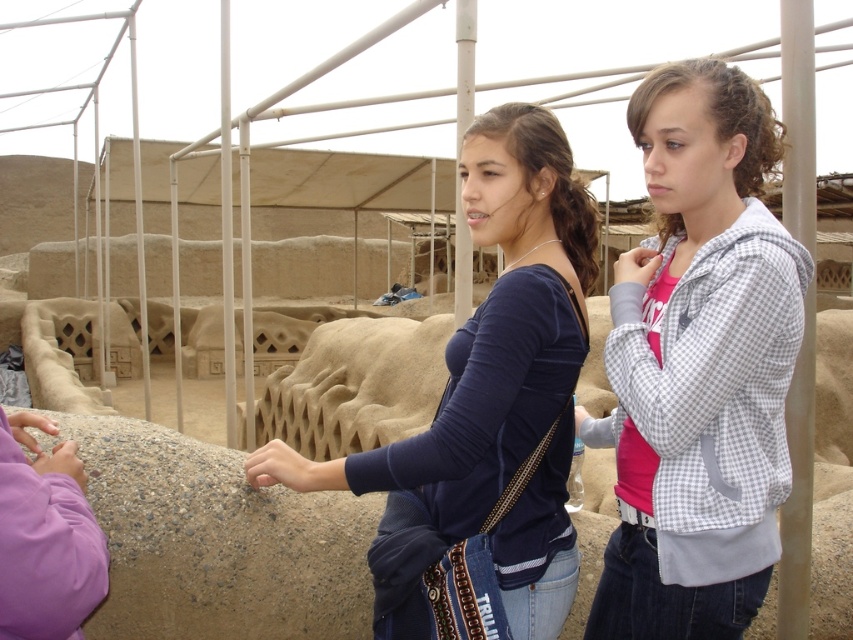
Question: Does white checkered jacket at center appear over dark blue jersey at center?

Choices:
 (A) yes
 (B) no

Answer: (B)

Question: Which of the following is the closest to the observer?

Choices:
 (A) (700, 227)
 (B) (462, 182)

Answer: (A)

Question: Is white checkered jacket at center further to camera compared to dark blue jersey at center?

Choices:
 (A) no
 (B) yes

Answer: (A)

Question: Which of the following is the farthest from the observer?

Choices:
 (A) (466, 339)
 (B) (746, 160)

Answer: (B)

Question: Can you confirm if white checkered jacket at center is bigger than dark blue jersey at center?

Choices:
 (A) no
 (B) yes

Answer: (A)